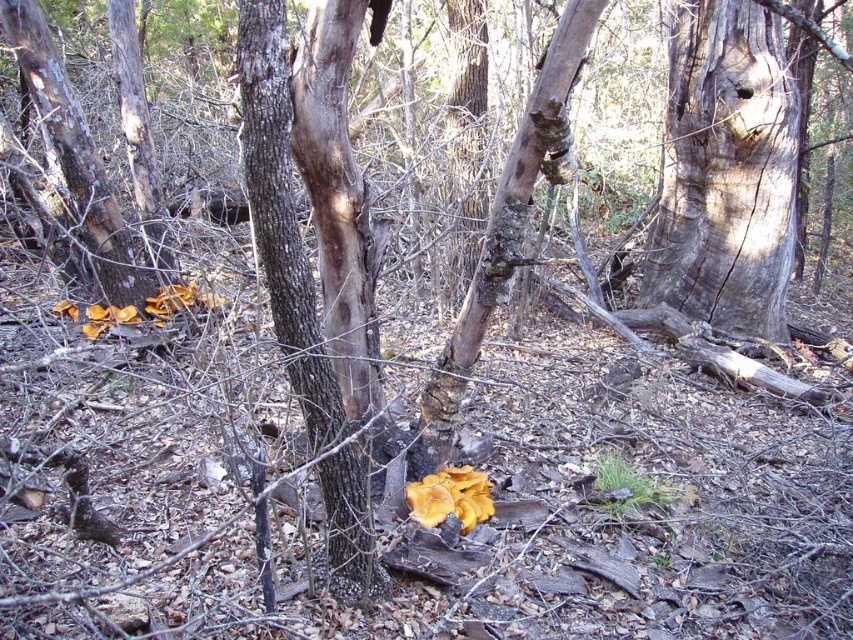
Question: Is the position of smooth gray bark at center less distant than that of brown rough bark at center?

Choices:
 (A) no
 (B) yes

Answer: (A)

Question: Which is nearer to the smooth brown tree trunk at left?

Choices:
 (A) brown rough bark at center
 (B) smooth gray bark at center

Answer: (A)

Question: Can you confirm if smooth gray bark at center is smaller than smooth brown tree trunk at left?

Choices:
 (A) yes
 (B) no

Answer: (B)

Question: Does smooth gray bark at center have a lesser width compared to smooth brown tree trunk at left?

Choices:
 (A) no
 (B) yes

Answer: (A)

Question: Which point is closer to the camera taking this photo?

Choices:
 (A) (795, 236)
 (B) (384, 573)

Answer: (B)

Question: Which point is closer to the camera?

Choices:
 (A) smooth gray bark at center
 (B) smooth brown tree trunk at left

Answer: (B)